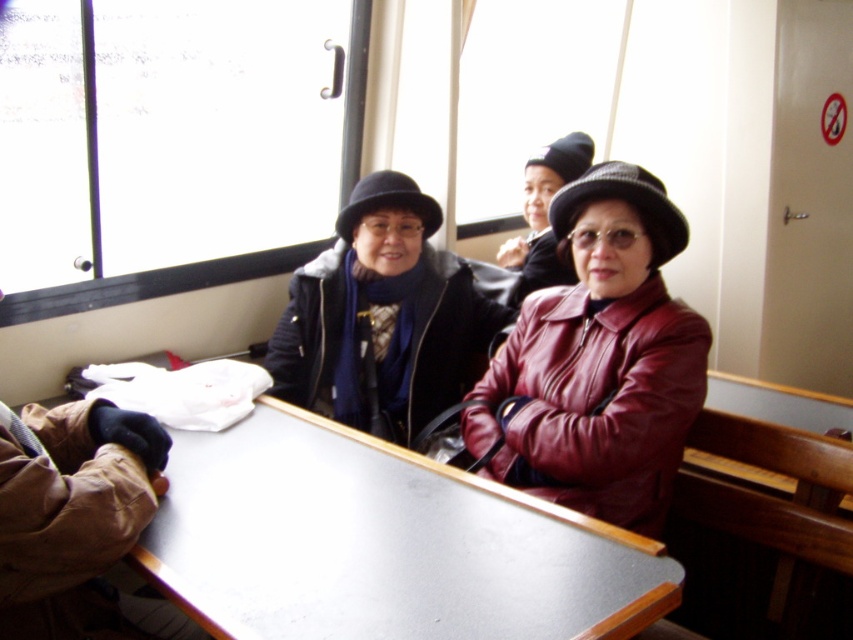
Describe the element at coordinates (381, 545) in the screenshot. I see `smooth gray table at center` at that location.

Is the position of smooth gray table at center more distant than that of leather jacket at center?

That is False.

Which is behind, point (190, 486) or point (683, 376)?

Positioned behind is point (683, 376).

In order to click on smooth gray table at center in this screenshot , I will do `click(381, 545)`.